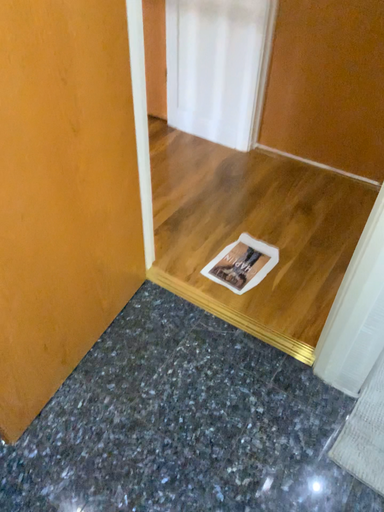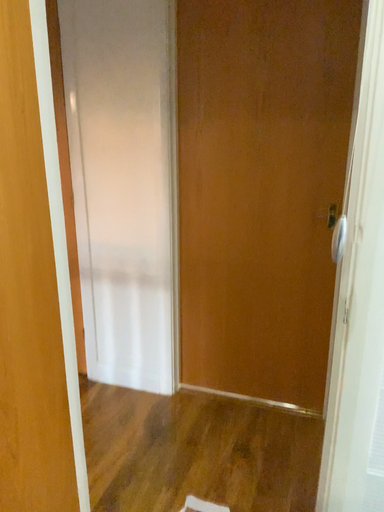
Question: Which way did the camera rotate in the video?

Choices:
 (A) rotated downward
 (B) rotated upward

Answer: (B)